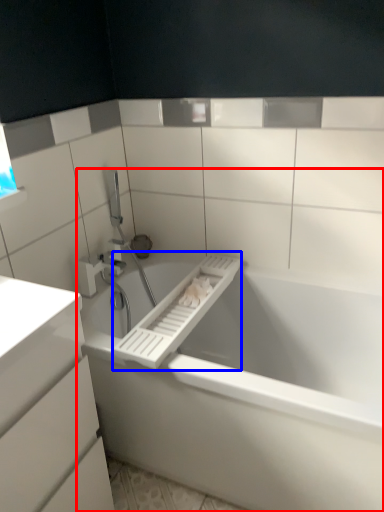
Question: Among these objects, which one is farthest to the camera, bathtub (highlighted by a red box) or towel bar (highlighted by a blue box)?

Choices:
 (A) bathtub
 (B) towel bar

Answer: (B)